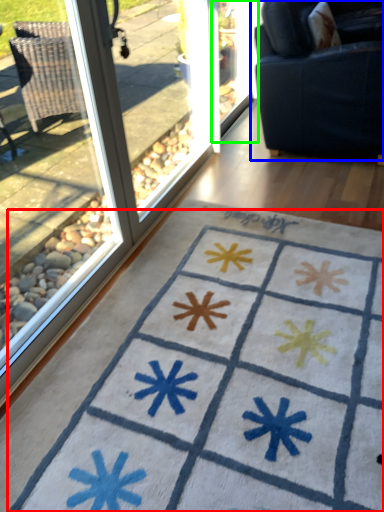
Question: Estimate the real-world distances between objects in this image. Which object is closer to doormat (highlighted by a red box), studio couch (highlighted by a blue box) or screen door (highlighted by a green box)?

Choices:
 (A) studio couch
 (B) screen door

Answer: (A)